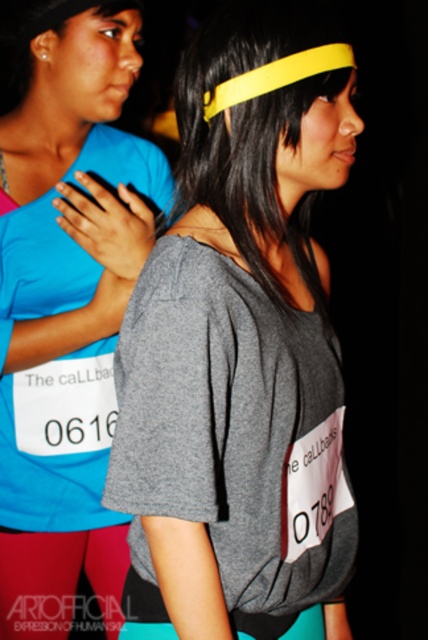
You are a photographer trying to capture the perfect shot of the race participants. You want to ensure that your focus point at point (x=240, y=342) is precisely on the gray matte t shirt at center. Is this point likely to be on the correct subject?

Yes, the point (x=240, y=342) is on the gray matte t shirt at center, so it is likely to be on the correct subject.

You are a photographer at a marathon event. You need to capture a photo of the two runners, the matte blue shirt at left and the matte pink leggings at lower left. The camera you are using has a limited depth of field and can only focus on one object at a time. Based on their positions, which runner should you focus on to ensure their face is clearly visible in the photo?

The matte blue shirt at left is much taller than the matte pink leggings at lower left, so focusing on the matte blue shirt at left will ensure their face is more clearly visible in the photo.